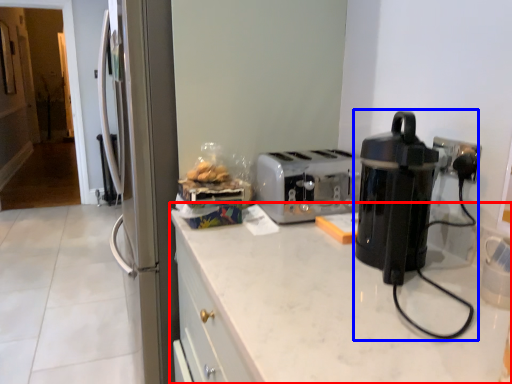
Question: Among these objects, which one is nearest to the camera, countertop (highlighted by a red box) or home appliance (highlighted by a blue box)?

Choices:
 (A) countertop
 (B) home appliance

Answer: (A)